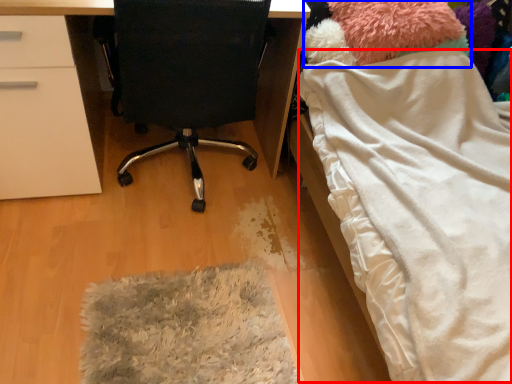
Question: Which of the following is the farthest to the observer, blanket (highlighted by a red box) or teddy (highlighted by a blue box)?

Choices:
 (A) blanket
 (B) teddy

Answer: (B)